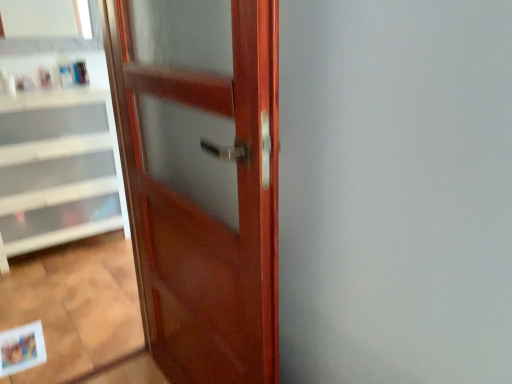
Question: Is glossy wood door at center in front of or behind white glossy cabinet at left in the image?

Choices:
 (A) front
 (B) behind

Answer: (A)

Question: Considering the positions of point (196, 271) and point (55, 117), is point (196, 271) closer or farther from the camera than point (55, 117)?

Choices:
 (A) farther
 (B) closer

Answer: (B)

Question: Which object is the farthest from the white glossy cabinet at left?

Choices:
 (A) matte plastic bottle at upper left, the first toiletry when ordered from left to right
 (B) glossy wood door at center
 (C) matte paper postcard at lower left
 (D) translucent plastic bottle at upper left, which ranks as the second toiletry in left-to-right order
 (E) matte plastic bottle at upper left, positioned as the third toiletry in left-to-right order

Answer: (B)

Question: Estimate the real-world distances between objects in this image. Which object is closer to the matte paper postcard at lower left?

Choices:
 (A) white glossy cabinet at left
 (B) matte plastic bottle at upper left, the first toiletry when ordered from left to right
 (C) matte plastic bottle at upper left, the first toiletry viewed from the right
 (D) glossy wood door at center
 (E) translucent plastic bottle at upper left, the 2th toiletry in the right-to-left sequence

Answer: (A)